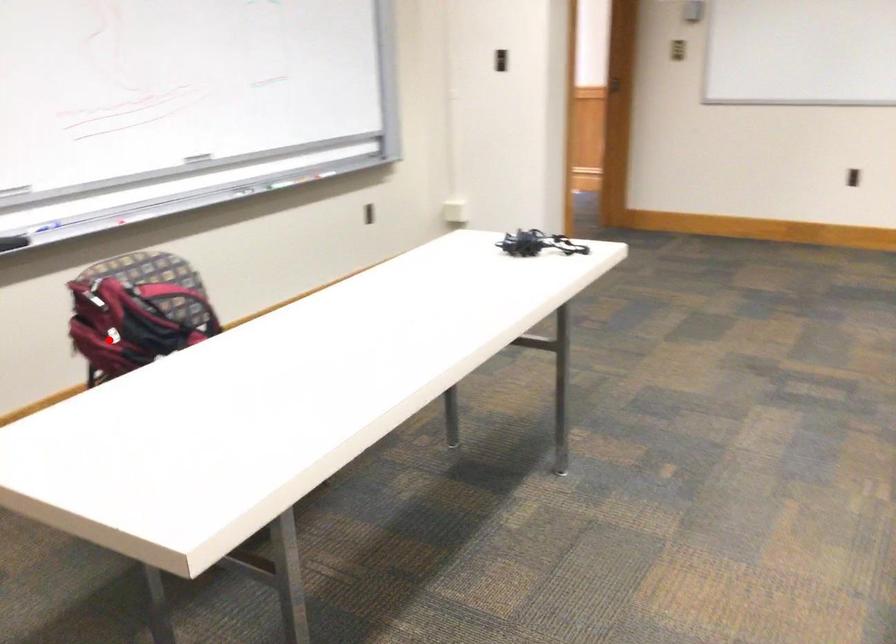
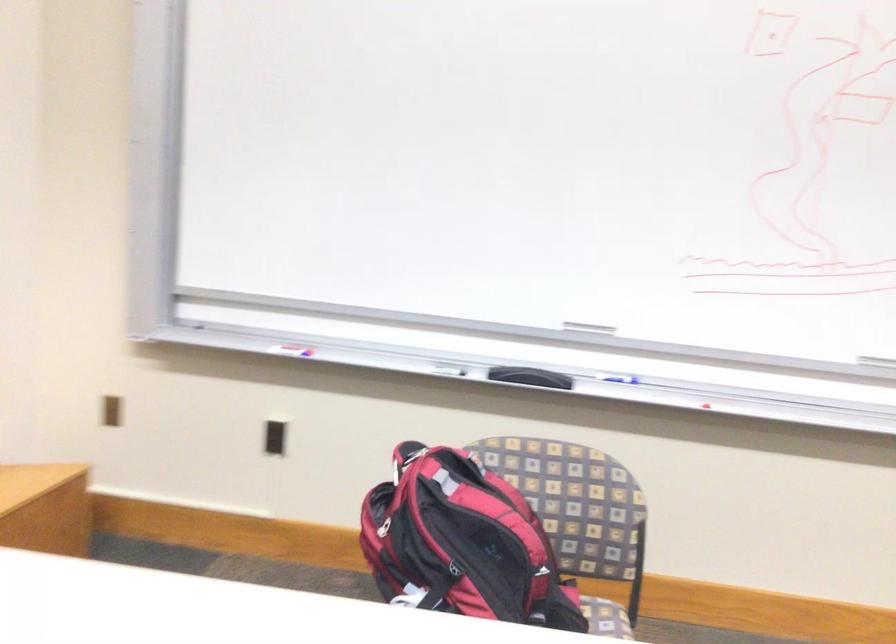
Where in the second image is the point corresponding to the highlighted location from the first image?

(383, 527)